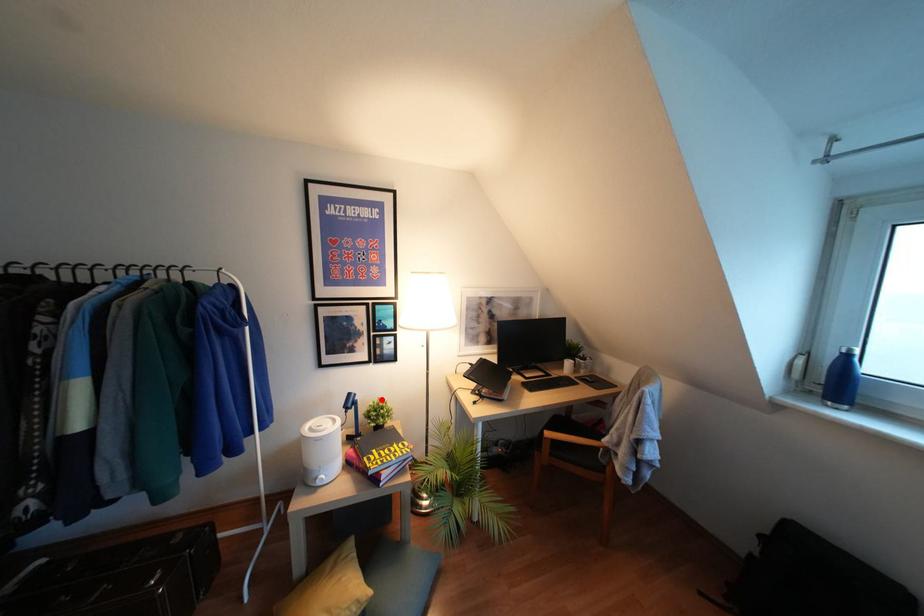
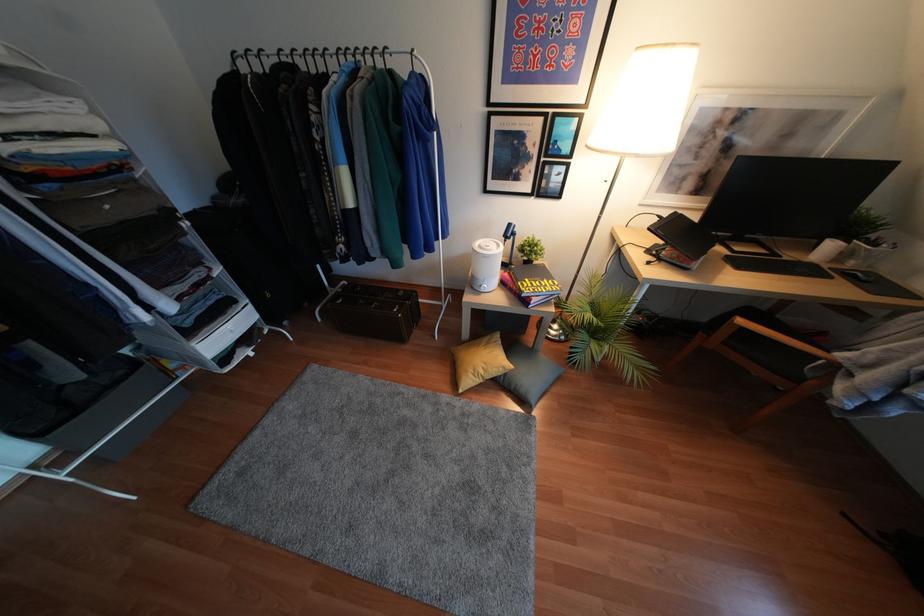
Question: I am providing you with two images of the same scene from different viewpoints. Given a red point in image1, look at the same physical point in image2. Is it:

Choices:
 (A) Closer to the viewpoint
 (B) Farther from the viewpoint

Answer: (A)